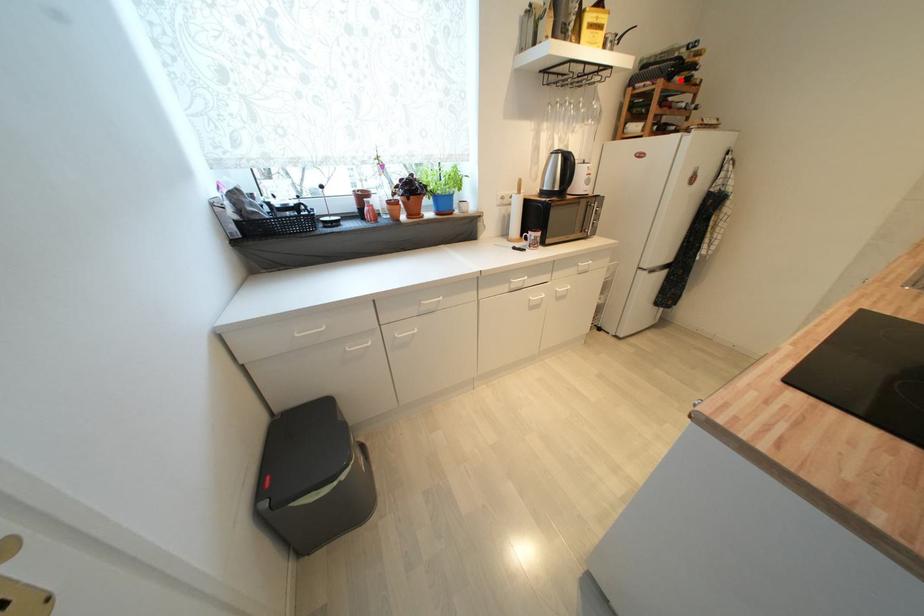
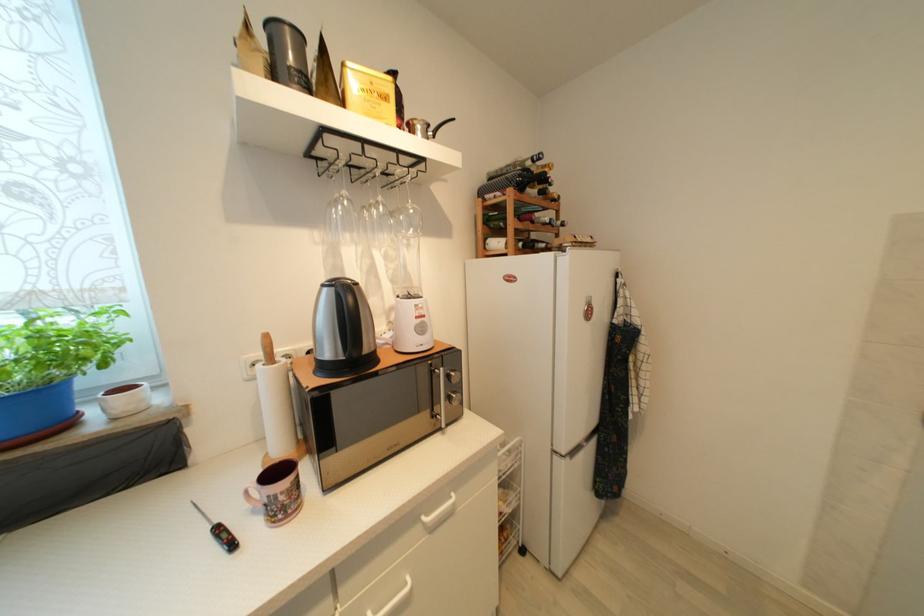
In the second image, find the point that corresponds to the highlighted location in the first image.

(533, 192)